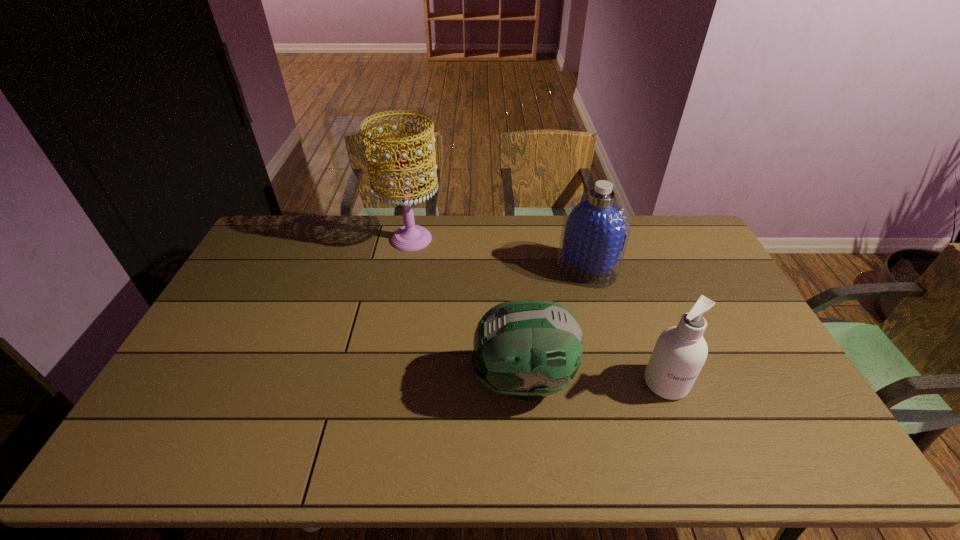
Identify the location of free space between the tallest object and the football helmet. The width and height of the screenshot is (960, 540). (467, 310).

The height and width of the screenshot is (540, 960). What are the coordinates of `free space between the football helmet and the tallest object` in the screenshot? It's located at [467, 310].

Find the location of a particular element. This screenshot has width=960, height=540. free space between the nearer cleansing agent and the farther cleansing agent is located at coordinates (626, 326).

Where is `object that stands as the third closest to the farther cleansing agent`? This screenshot has width=960, height=540. object that stands as the third closest to the farther cleansing agent is located at coordinates (410, 237).

Find the location of a particular element. object that is the third nearest to the second object from left to right is located at coordinates (410, 237).

Where is `vacant space that satisfies the following two spatial constraints: 1. on the front side of the farther cleansing agent; 2. on the visor of the football helmet`? The width and height of the screenshot is (960, 540). vacant space that satisfies the following two spatial constraints: 1. on the front side of the farther cleansing agent; 2. on the visor of the football helmet is located at coordinates (617, 381).